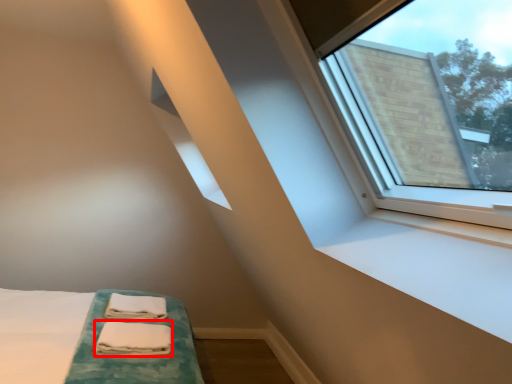
Question: Observing the image, what is the correct spatial positioning of sheet (annotated by the red box) in reference to bath towel?

Choices:
 (A) left
 (B) right

Answer: (B)